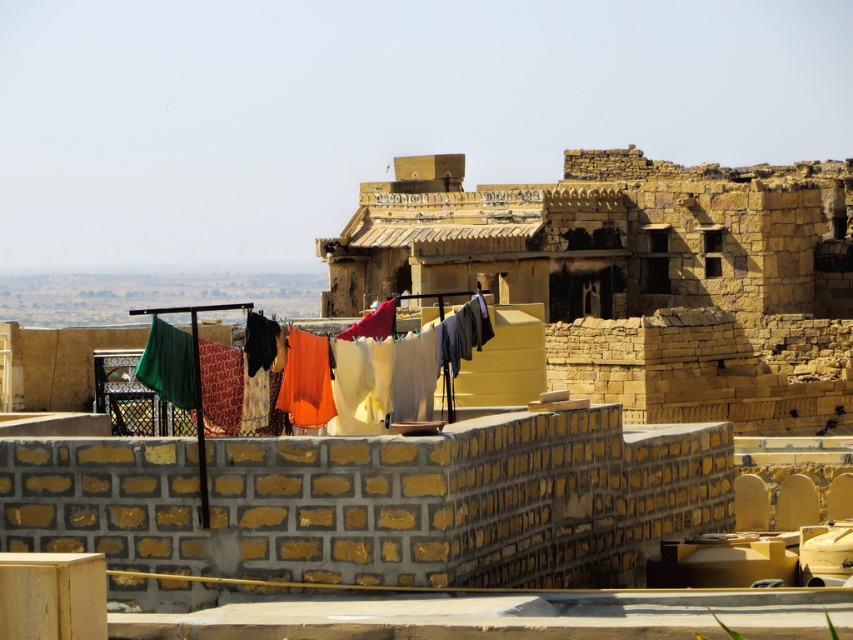
At what (x,y) coordinates should I click in order to perform the action: click on rustic stone fort at center. Please return your answer as a coordinate pair (x, y). Looking at the image, I should click on (635, 275).

What do you see at coordinates (635, 275) in the screenshot? I see `rustic stone fort at center` at bounding box center [635, 275].

Between point (720, 333) and point (286, 349), which one is positioned behind?

Positioned behind is point (720, 333).

This screenshot has width=853, height=640. I want to click on rustic stone fort at center, so click(635, 275).